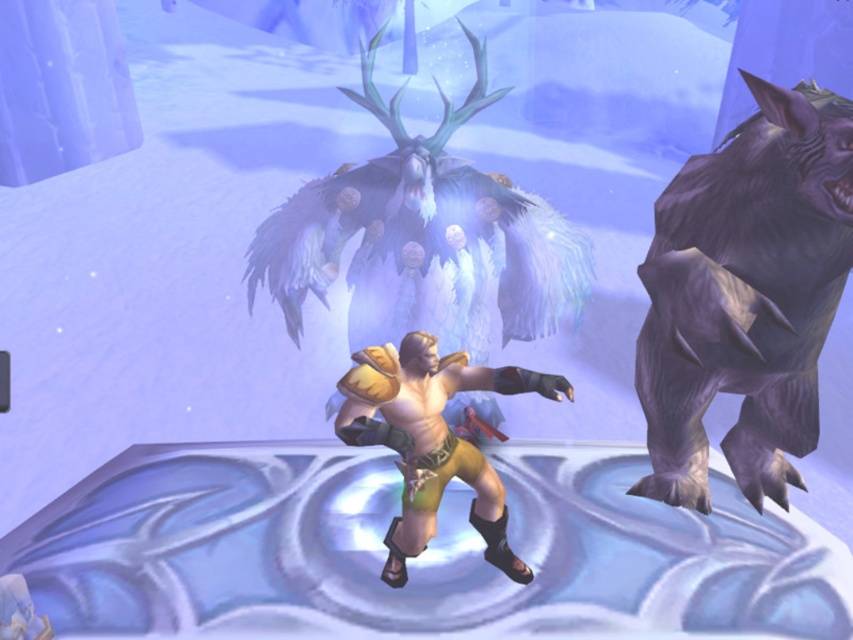
Who is more distant from viewer, (762, 81) or (405, 401)?

Point (405, 401)

Between gray furry bear at right and golden leather armor at center, which one has more height?

gray furry bear at right

You are a GUI agent. You are given a task and a screenshot of the screen. Output one action in this format:
    pyautogui.click(x=<x>, y=<y>)
    Task: Click on the gray furry bear at right
    Image resolution: width=853 pixels, height=640 pixels.
    Given the screenshot: What is the action you would take?
    pyautogui.click(x=746, y=294)

This screenshot has height=640, width=853. I want to click on gray furry bear at right, so click(x=746, y=294).